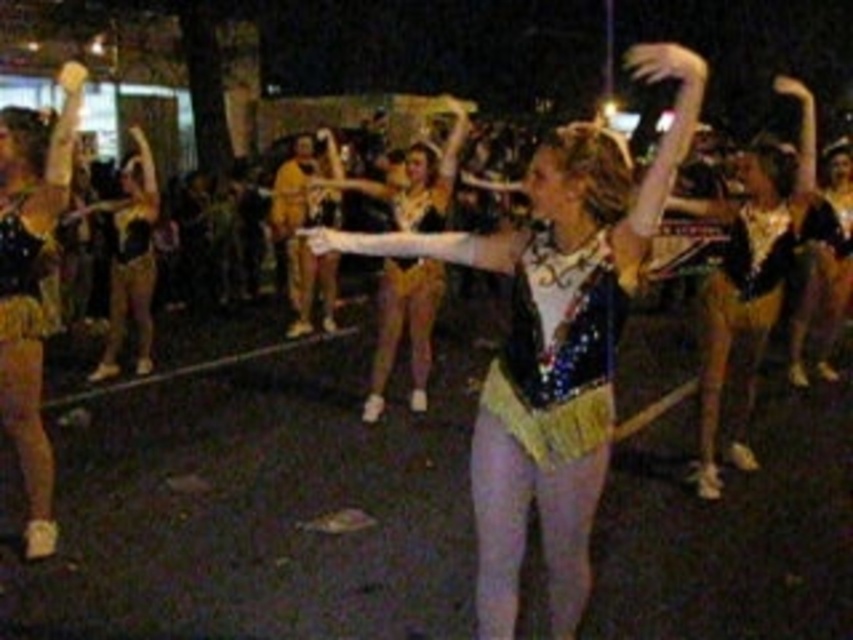
Question: Which object is farther from the camera taking this photo?

Choices:
 (A) sparkly sequined top at center
 (B) sparkly sequined leotard at center
 (C) shiny gold shorts at left

Answer: (A)

Question: Considering the relative positions of sparkly sequined leotard at center and shiny gold shorts at left in the image provided, where is sparkly sequined leotard at center located with respect to shiny gold shorts at left?

Choices:
 (A) below
 (B) above

Answer: (B)

Question: Can you confirm if sparkly sequined leotard at center is smaller than shiny gold shorts at left?

Choices:
 (A) no
 (B) yes

Answer: (B)

Question: Does sparkly sequined leotard at center have a lesser width compared to sparkly sequined top at center?

Choices:
 (A) yes
 (B) no

Answer: (B)

Question: Which is farther from the shiny gold shorts at left?

Choices:
 (A) sparkly sequined leotard at center
 (B) sparkly sequined top at center

Answer: (B)

Question: Which point is farther to the camera?

Choices:
 (A) (425, 218)
 (B) (540, 230)
 (C) (51, 474)

Answer: (A)